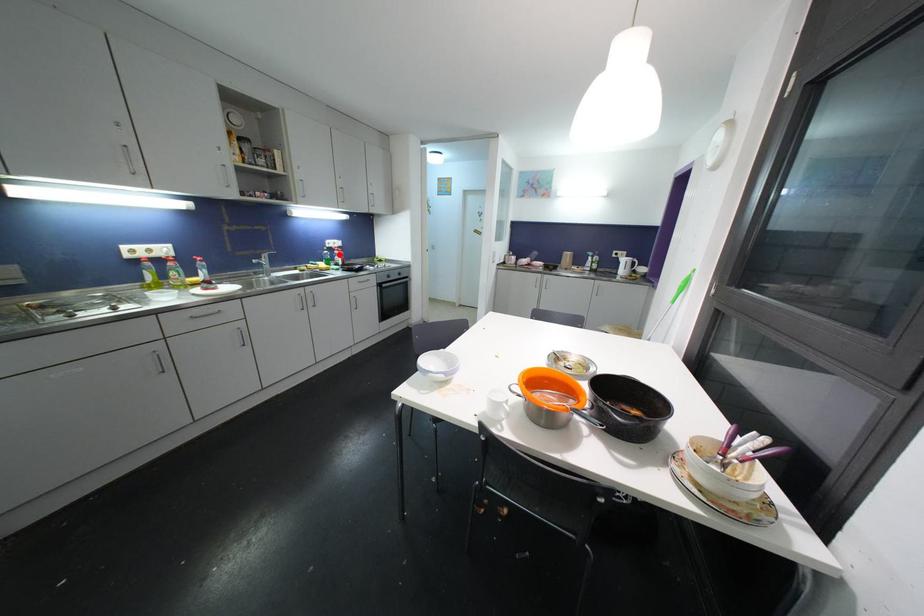
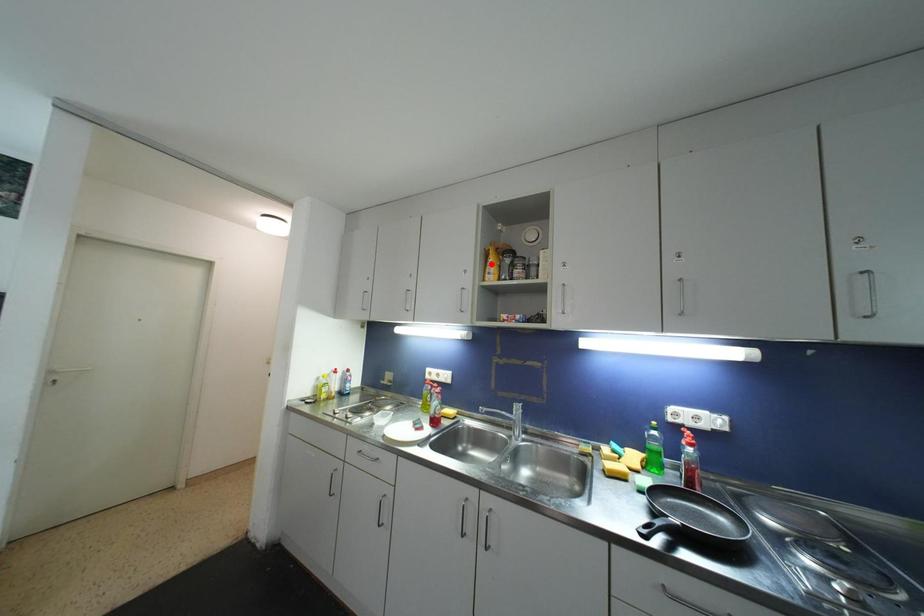
I am providing you with two images of the same scene from different viewpoints. A red point is marked on the first image and another point is marked on the second image. Does the point marked in image1 correspond to the same location as the one in image2?

No